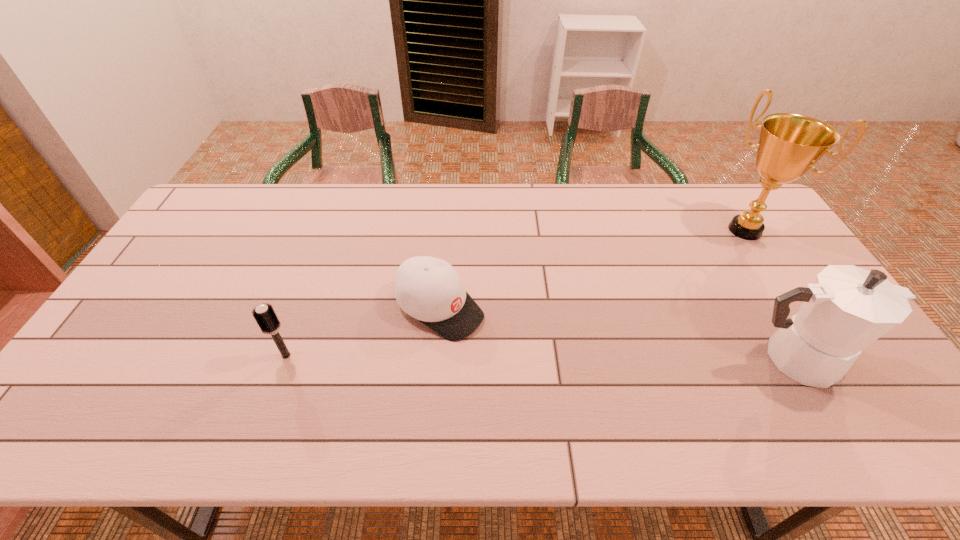
The width and height of the screenshot is (960, 540). I want to click on vacant space at the far edge, so click(265, 193).

This screenshot has width=960, height=540. In the image, there is a desktop. Find the location of `free space at the near edge`. free space at the near edge is located at coordinates (652, 369).

You are a GUI agent. You are given a task and a screenshot of the screen. Output one action in this format:
    pyautogui.click(x=<x>, y=<y>)
    Task: Click on the unoccupied position between the farthest object and the baseball cap
    
    Given the screenshot: What is the action you would take?
    pyautogui.click(x=592, y=269)

You are a GUI agent. You are given a task and a screenshot of the screen. Output one action in this format:
    pyautogui.click(x=<x>, y=<y>)
    Task: Click on the vacant point located between the second shortest object and the tallest object
    This screenshot has width=960, height=540.
    Given the screenshot: What is the action you would take?
    pyautogui.click(x=516, y=293)

Where is `free spot between the tallest object and the baseball cap`? free spot between the tallest object and the baseball cap is located at coordinates (592, 269).

Image resolution: width=960 pixels, height=540 pixels. Find the location of `free space between the second shortest object and the coffeepot`. free space between the second shortest object and the coffeepot is located at coordinates pos(540,357).

Locate an element on the screen. free space between the award and the second shortest object is located at coordinates (516, 293).

Where is `vacant space that is in between the leftmost object and the baseball cap`? This screenshot has width=960, height=540. vacant space that is in between the leftmost object and the baseball cap is located at coordinates (363, 332).

Find the location of a particular element. free space between the third object from right to left and the second shortest object is located at coordinates (363, 332).

Locate an element on the screen. The height and width of the screenshot is (540, 960). unoccupied area between the award and the leftmost object is located at coordinates (516, 293).